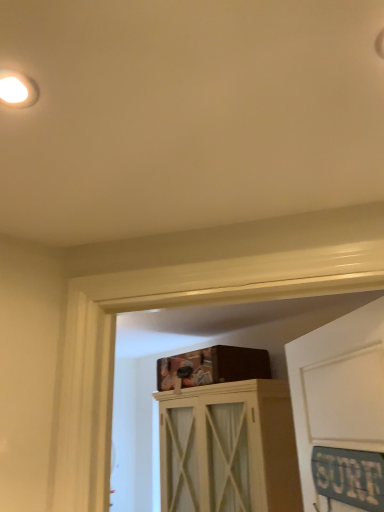
Question: In terms of width, does white wood cabinet at center look wider or thinner when compared to white matte droplight at upper left?

Choices:
 (A) thin
 (B) wide

Answer: (B)

Question: From the image's perspective, is white wood cabinet at center located above or below white matte droplight at upper left?

Choices:
 (A) above
 (B) below

Answer: (B)

Question: In terms of height, does white wood cabinet at center look taller or shorter compared to white matte droplight at upper left?

Choices:
 (A) short
 (B) tall

Answer: (B)

Question: Considering the positions of white matte droplight at upper left and white wood cabinet at center in the image, is white matte droplight at upper left taller or shorter than white wood cabinet at center?

Choices:
 (A) short
 (B) tall

Answer: (A)

Question: Is white matte droplight at upper left to the left or to the right of white wood cabinet at center in the image?

Choices:
 (A) right
 (B) left

Answer: (B)

Question: Is point (11, 86) closer or farther from the camera than point (208, 490)?

Choices:
 (A) farther
 (B) closer

Answer: (B)

Question: From a real-world perspective, is white matte droplight at upper left positioned above or below white wood cabinet at center?

Choices:
 (A) below
 (B) above

Answer: (B)